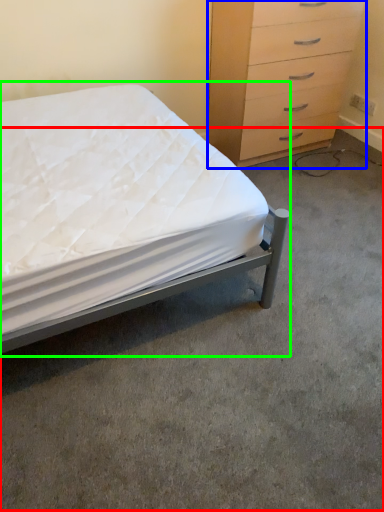
Question: Which object is positioned closest to concrete (highlighted by a red box)? Select from chest of drawers (highlighted by a blue box) and bed (highlighted by a green box).

Choices:
 (A) chest of drawers
 (B) bed

Answer: (B)